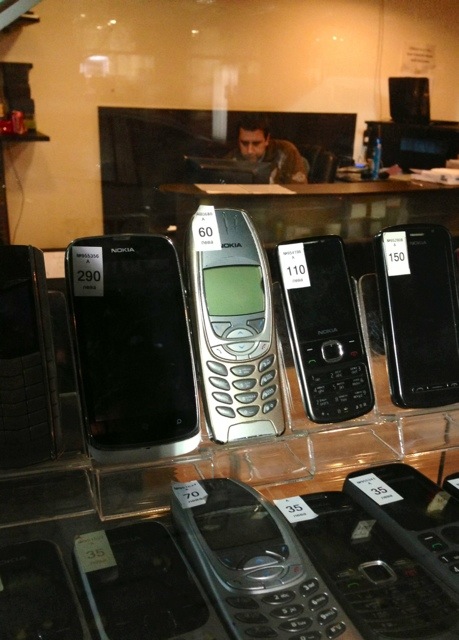
You are a GUI agent. You are given a task and a screenshot of the screen. Output one action in this format:
    pyautogui.click(x=<x>, y=<y>)
    Task: Click on the screen
    Image resolution: width=459 pixels, height=640 pixels.
    Given the screenshot: What is the action you would take?
    pyautogui.click(x=344, y=523), pyautogui.click(x=406, y=502), pyautogui.click(x=48, y=595), pyautogui.click(x=31, y=326), pyautogui.click(x=112, y=308), pyautogui.click(x=225, y=283), pyautogui.click(x=332, y=294), pyautogui.click(x=415, y=310)